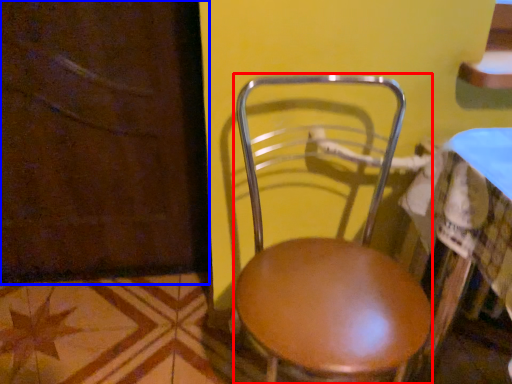
Question: Which object appears closest to the camera in this image, chair (highlighted by a red box) or screen door (highlighted by a blue box)?

Choices:
 (A) chair
 (B) screen door

Answer: (A)